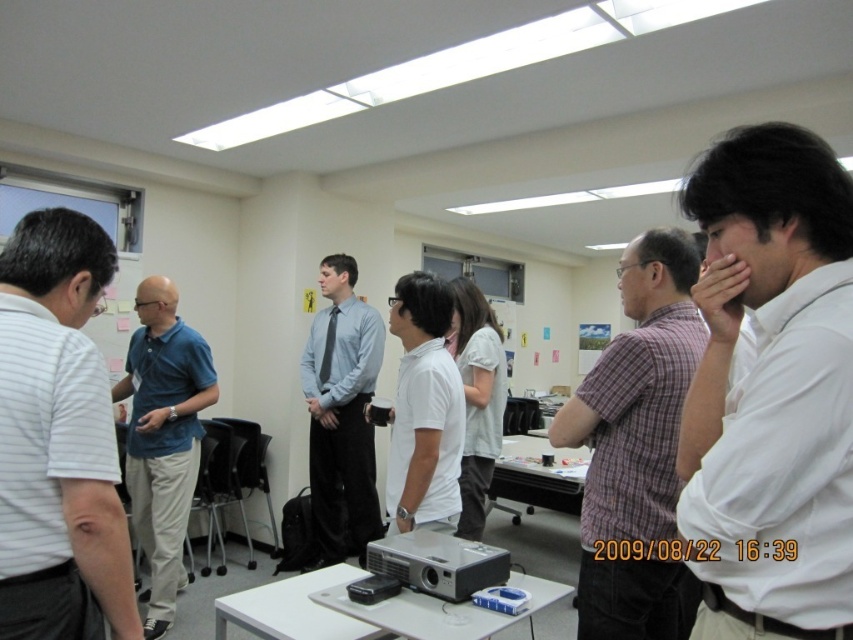
Does white shirt at right appear over silver metallic projector at center?

Indeed, white shirt at right is positioned over silver metallic projector at center.

Can you confirm if white shirt at right is shorter than silver metallic projector at center?

Incorrect, white shirt at right's height does not fall short of silver metallic projector at center's.

Where is `white shirt at right`? Image resolution: width=853 pixels, height=640 pixels. white shirt at right is located at coordinates (773, 381).

Is white shirt at right further to camera compared to light blue shirt at center?

No, white shirt at right is in front of light blue shirt at center.

From the picture: Is white shirt at right to the right of light blue shirt at center from the viewer's perspective?

Indeed, white shirt at right is positioned on the right side of light blue shirt at center.

Is point (701, 461) more distant than point (361, 534)?

No, (701, 461) is in front of (361, 534).

I want to click on white shirt at right, so click(773, 381).

Does light blue shirt at center have a lesser width compared to silver metallic projector at center?

In fact, light blue shirt at center might be wider than silver metallic projector at center.

Does point (337, 285) lie behind point (477, 556)?

Yes, point (337, 285) is farther from viewer.

What do you see at coordinates (341, 413) in the screenshot? This screenshot has width=853, height=640. I see `light blue shirt at center` at bounding box center [341, 413].

Find the location of a particular element. Image resolution: width=853 pixels, height=640 pixels. light blue shirt at center is located at coordinates (341, 413).